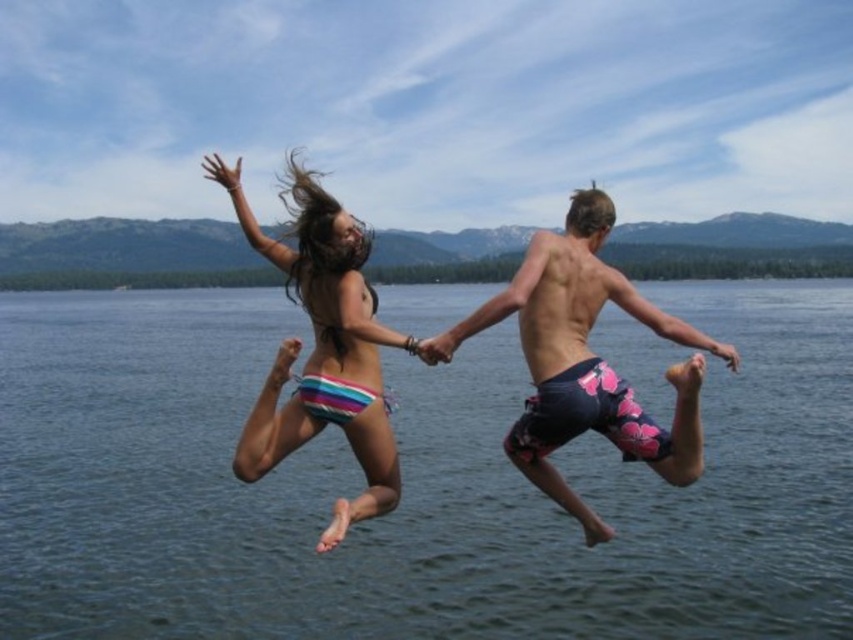
Question: Can you confirm if dark blue floral swim trunks at center is positioned to the right of striped fabric bikini bottom at center?

Choices:
 (A) no
 (B) yes

Answer: (B)

Question: Can you confirm if clear blue water at center is bigger than striped fabric bikini bottom at center?

Choices:
 (A) yes
 (B) no

Answer: (A)

Question: Which is nearer to the striped fabric bikini bottom at center?

Choices:
 (A) clear blue water at center
 (B) dark blue floral swim trunks at center

Answer: (B)

Question: Which of the following is the closest to the observer?

Choices:
 (A) striped fabric bikini bottom at center
 (B) dark blue floral swim trunks at center

Answer: (B)

Question: Which of the following is the closest to the observer?

Choices:
 (A) (753, 316)
 (B) (693, 403)

Answer: (B)

Question: Is clear blue water at center to the right of striped fabric bikini bottom at center from the viewer's perspective?

Choices:
 (A) no
 (B) yes

Answer: (B)